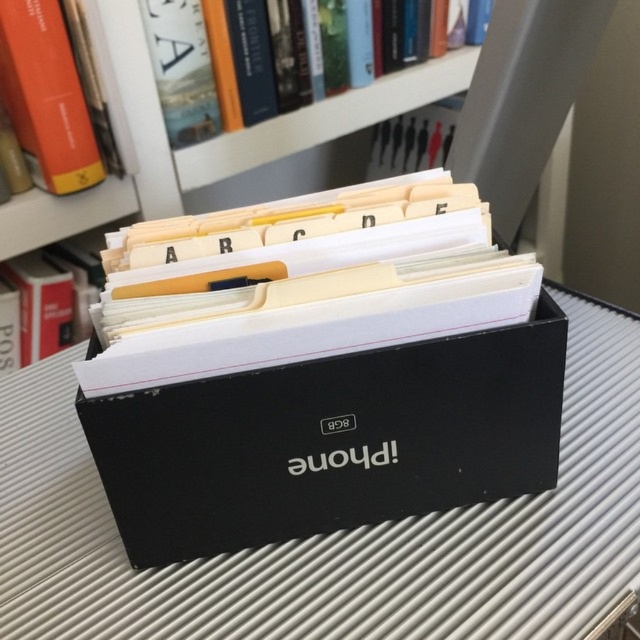
Looking at this image, is black matte box at center below orange hardcover book at upper left?

Yes, black matte box at center is below orange hardcover book at upper left.

What do you see at coordinates (337, 532) in the screenshot? I see `black matte box at center` at bounding box center [337, 532].

What do you see at coordinates (337, 532) in the screenshot? I see `black matte box at center` at bounding box center [337, 532].

Identify the location of black matte box at center. The image size is (640, 640). (337, 532).

Between black matte box at center and hardcover book at upper center, which one appears on the right side from the viewer's perspective?

hardcover book at upper center

Is point (148, 612) positioned in front of point (168, 65)?

Yes, point (148, 612) is closer to viewer.

What do you see at coordinates (337, 532) in the screenshot?
I see `black matte box at center` at bounding box center [337, 532].

At what (x,y) coordinates should I click in order to perform the action: click on black matte box at center. Please return your answer as a coordinate pair (x, y). Image resolution: width=640 pixels, height=640 pixels. Looking at the image, I should click on (337, 532).

The width and height of the screenshot is (640, 640). Find the location of `hardcover book at upper center`. hardcover book at upper center is located at coordinates (336, 92).

Is hardcover book at upper center thinner than orange hardcover book at upper left?

Incorrect, hardcover book at upper center's width is not less than orange hardcover book at upper left's.

Which is behind, point (179, 96) or point (20, 97)?

The point (179, 96) is more distant.

The height and width of the screenshot is (640, 640). Find the location of `hardcover book at upper center`. hardcover book at upper center is located at coordinates (336, 92).